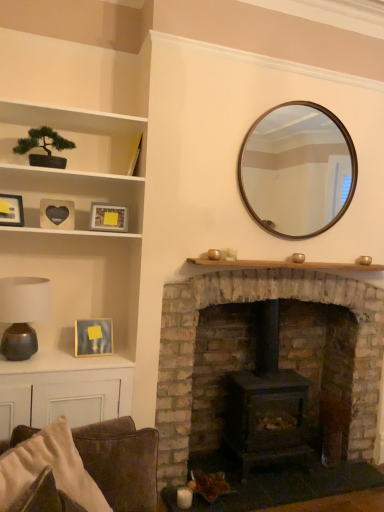
What are the coordinates of `vacant region above wooden frame mirror at upper center (from a real-world perspective)` in the screenshot? It's located at (305, 102).